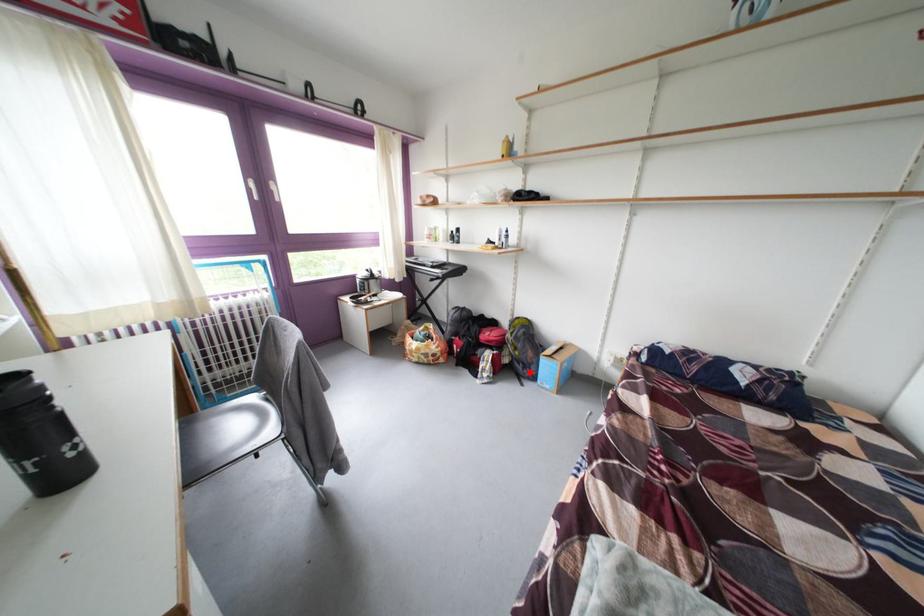
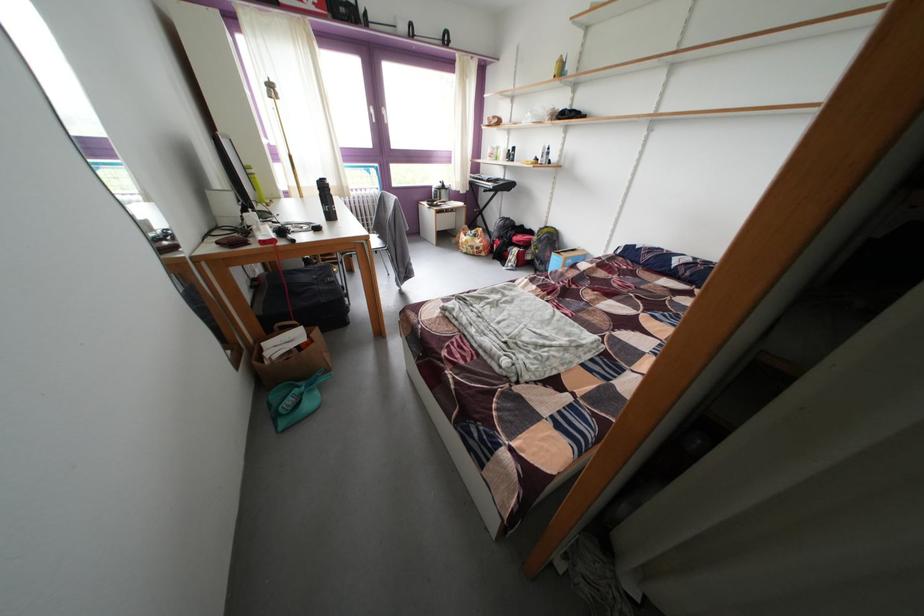
Question: A red point is marked in image1. In image2, is the corresponding 3D point closer to the camera or farther? Reply with the corresponding letter.

Choices:
 (A) The corresponding 3D point is closer.
 (B) The corresponding 3D point is farther.

Answer: (B)